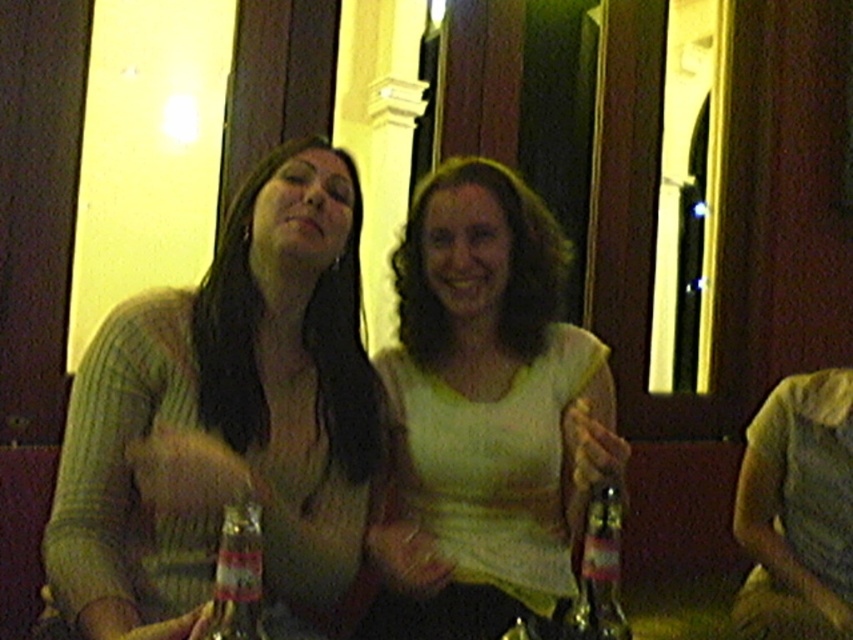
Which is in front, point (190, 616) or point (598, 596)?

Positioned in front is point (598, 596).

Can you confirm if knitted sweater at left is taller than translucent glass bottle at center?

Correct, knitted sweater at left is much taller as translucent glass bottle at center.

Is point (251, 177) behind point (618, 524)?

Yes.

Image resolution: width=853 pixels, height=640 pixels. I want to click on knitted sweater at left, so click(x=225, y=416).

Is knitted sweater at left in front of light green fabric shirt at center?

Yes, it is.

Is point (161, 573) positioned before point (485, 160)?

Yes, it is in front of point (485, 160).

Who is more forward, (207, 460) or (532, 486)?

Point (207, 460) is more forward.

Identify the location of knitted sweater at left. (225, 416).

Is light green fabric shirt at center behind clear glass bottle at center?

That is True.

Is point (570, 554) positioned in front of point (236, 550)?

That is False.

The height and width of the screenshot is (640, 853). What are the coordinates of `light green fabric shirt at center` in the screenshot? It's located at (485, 413).

Where is `light green fabric shirt at center`? light green fabric shirt at center is located at coordinates (485, 413).